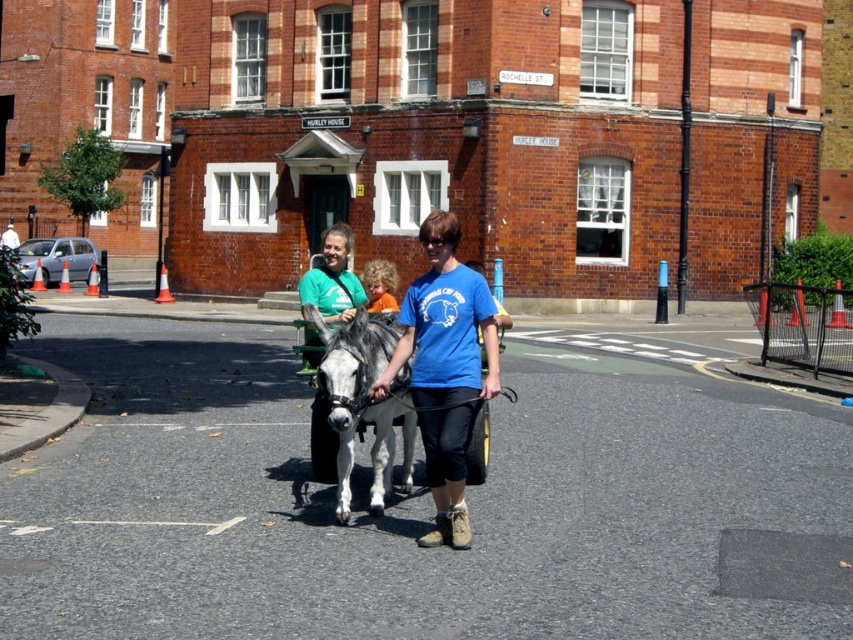
Where is `gray matte mule at center`? This screenshot has width=853, height=640. gray matte mule at center is located at coordinates (364, 401).

Who is higher up, gray matte mule at center or matte green t-shirt at center?

matte green t-shirt at center

Between point (339, 500) and point (340, 250), which one is positioned behind?

Point (340, 250)

I want to click on gray matte mule at center, so click(x=364, y=401).

Between point (344, 518) and point (310, 330), which one is positioned in front?

Point (344, 518)

From the picture: Who is more forward, (340, 480) or (476, 433)?

Point (340, 480) is more forward.

The image size is (853, 640). Identify the location of gray matte mule at center. (364, 401).

Can you confirm if blue cotton shirt at center is positioned to the left of matte green t-shirt at center?

Incorrect, blue cotton shirt at center is not on the left side of matte green t-shirt at center.

Can you confirm if blue cotton shirt at center is positioned below matte green t-shirt at center?

Correct, blue cotton shirt at center is located below matte green t-shirt at center.

Between point (434, 241) and point (337, 262), which one is positioned in front?

Point (434, 241)

At what (x,y) coordinates should I click in order to perform the action: click on blue cotton shirt at center. Please return your answer as a coordinate pair (x, y). Image resolution: width=853 pixels, height=640 pixels. Looking at the image, I should click on (445, 369).